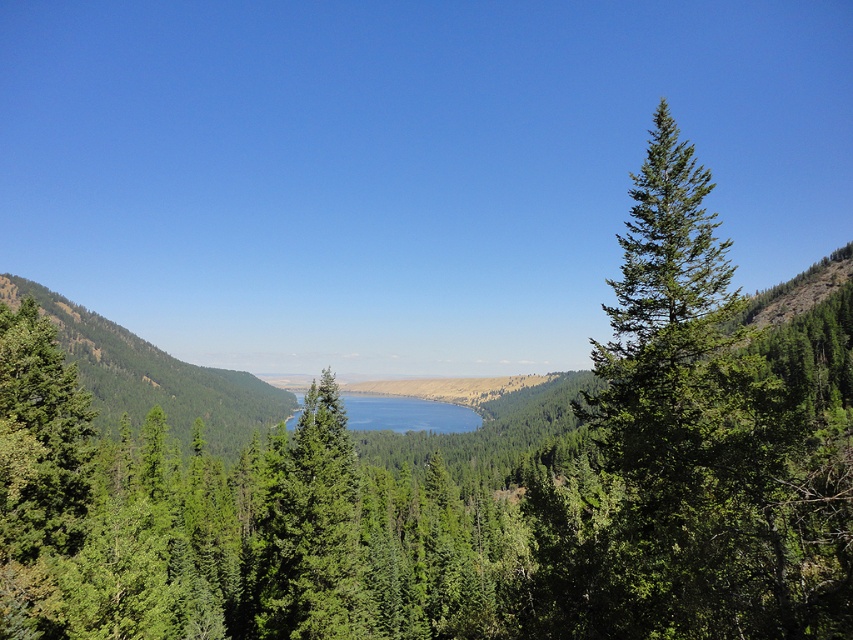
You are standing at the point with coordinates (x=154, y=378) in the image. What is the name of the object located exactly at this point?

The object located at point (x=154, y=378) is the green forested mountain at center.

You are planning to build a small boat dock on the side of the blue reflective water at center. Considering the width of the green forested mountain at center, do you think the dock will fit on the water side without overlapping the mountain?

The green forested mountain at center might be wider than blue reflective water at center, so there is a possibility that the dock might overlap with the mountain if placed on the water side. It is recommended to check the exact dimensions before building.

You are an environmental scientist observing the landscape. You need to determine the elevation difference between the green forested mountain at center and the blue reflective water at center. Which one is higher in elevation?

The green forested mountain at center is above the blue reflective water at center, so it has a higher elevation.